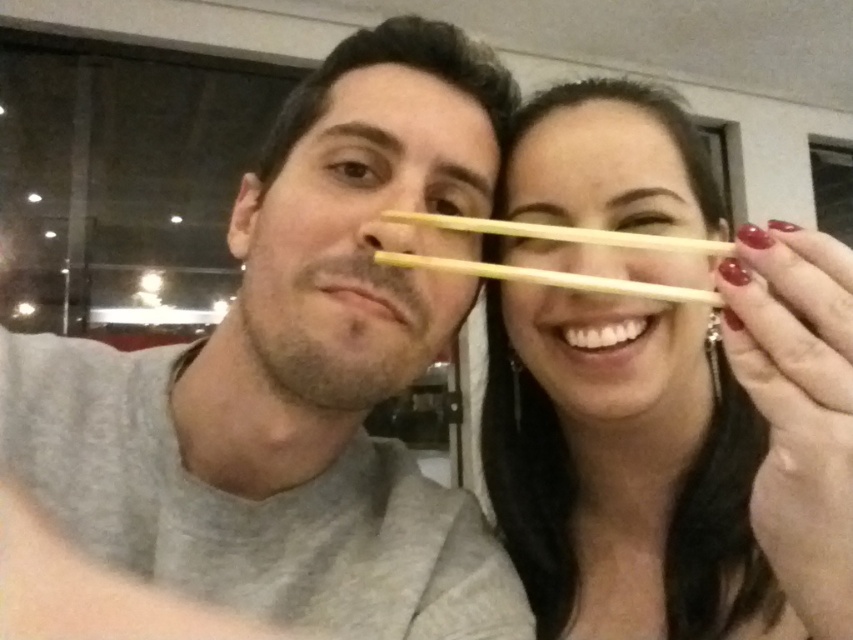
Is matte gray shirt at center wider than wooden chopsticks at center?

Indeed, matte gray shirt at center has a greater width compared to wooden chopsticks at center.

Does matte gray shirt at center come behind wooden chopsticks at center?

Yes, matte gray shirt at center is further from the viewer.

This screenshot has height=640, width=853. Find the location of `matte gray shirt at center`. matte gray shirt at center is located at coordinates (277, 394).

Is smooth wood chopsticks at upper right to the left of wooden chopsticks at center from the viewer's perspective?

Incorrect, smooth wood chopsticks at upper right is not on the left side of wooden chopsticks at center.

Does smooth wood chopsticks at upper right have a lesser width compared to wooden chopsticks at center?

Incorrect, smooth wood chopsticks at upper right's width is not less than wooden chopsticks at center's.

The height and width of the screenshot is (640, 853). What do you see at coordinates (676, 442) in the screenshot?
I see `smooth wood chopsticks at upper right` at bounding box center [676, 442].

This screenshot has height=640, width=853. Find the location of `smooth wood chopsticks at upper right`. smooth wood chopsticks at upper right is located at coordinates (676, 442).

Does matte gray shirt at center have a greater width compared to smooth wood chopsticks at upper right?

Yes.

Who is more forward, (225, 492) or (643, 326)?

Positioned in front is point (225, 492).

Who is more distant from viewer, (224, 442) or (787, 547)?

Point (224, 442)

This screenshot has height=640, width=853. Identify the location of matte gray shirt at center. (277, 394).